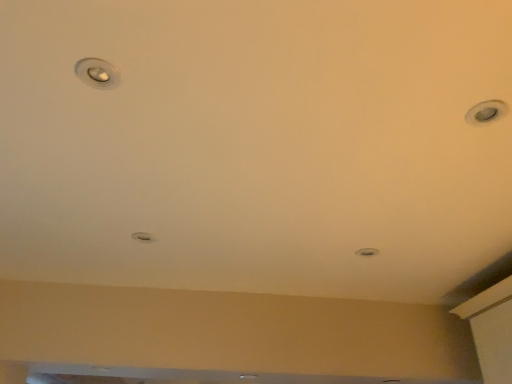
Question: Is matte silver droplight at upper left, which ranks as the 2th droplight in back-to-front order, aimed at matte silver droplight at center, the 2th droplight when ordered from top to bottom?

Choices:
 (A) no
 (B) yes

Answer: (A)

Question: From a real-world perspective, is matte silver droplight at upper left, which is the second droplight from bottom to top, on matte silver droplight at center, which is the 2th droplight from front to back?

Choices:
 (A) yes
 (B) no

Answer: (A)

Question: Is matte silver droplight at center, which is the 2th droplight from front to back, completely or partially inside matte silver droplight at upper left, which is the second droplight from bottom to top?

Choices:
 (A) no
 (B) yes

Answer: (A)

Question: Is matte silver droplight at upper left, marked as the first droplight in a front-to-back arrangement, turned away from matte silver droplight at center, which is the 2th droplight from front to back?

Choices:
 (A) yes
 (B) no

Answer: (B)

Question: Can you confirm if matte silver droplight at upper left, which is the second droplight from bottom to top, is wider than matte silver droplight at center, acting as the first droplight starting from the back?

Choices:
 (A) yes
 (B) no

Answer: (B)

Question: Is matte silver droplight at upper left, the second droplight from the left, in front of matte silver droplight at center, acting as the first droplight starting from the back?

Choices:
 (A) yes
 (B) no

Answer: (A)

Question: Does matte silver droplight at upper left, marked as the first droplight in a front-to-back arrangement, appear on the right side of matte silver light at center?

Choices:
 (A) no
 (B) yes

Answer: (A)

Question: Can you confirm if matte silver droplight at upper left, marked as the 1th droplight in a top-to-bottom arrangement, is smaller than matte silver light at center?

Choices:
 (A) no
 (B) yes

Answer: (B)

Question: Does matte silver droplight at upper left, which is the second droplight from bottom to top, have a lesser height compared to matte silver light at center?

Choices:
 (A) yes
 (B) no

Answer: (A)

Question: Does matte silver droplight at upper left, which ranks as the 2th droplight in back-to-front order, have a greater width compared to matte silver light at center?

Choices:
 (A) no
 (B) yes

Answer: (A)

Question: Is matte silver droplight at upper left, marked as the first droplight in a front-to-back arrangement, looking in the opposite direction of matte silver light at center?

Choices:
 (A) yes
 (B) no

Answer: (B)

Question: Does matte silver droplight at upper left, which is the second droplight from bottom to top, have a lesser width compared to matte silver light at center?

Choices:
 (A) no
 (B) yes

Answer: (B)

Question: From a real-world perspective, is matte silver droplight at center, acting as the first droplight starting from the back, located beneath matte silver light at center?

Choices:
 (A) yes
 (B) no

Answer: (A)